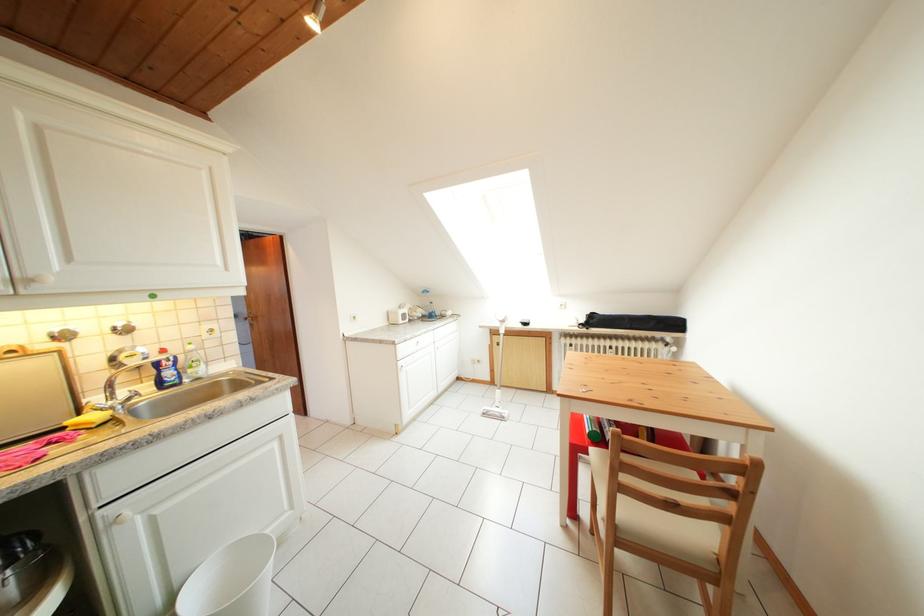
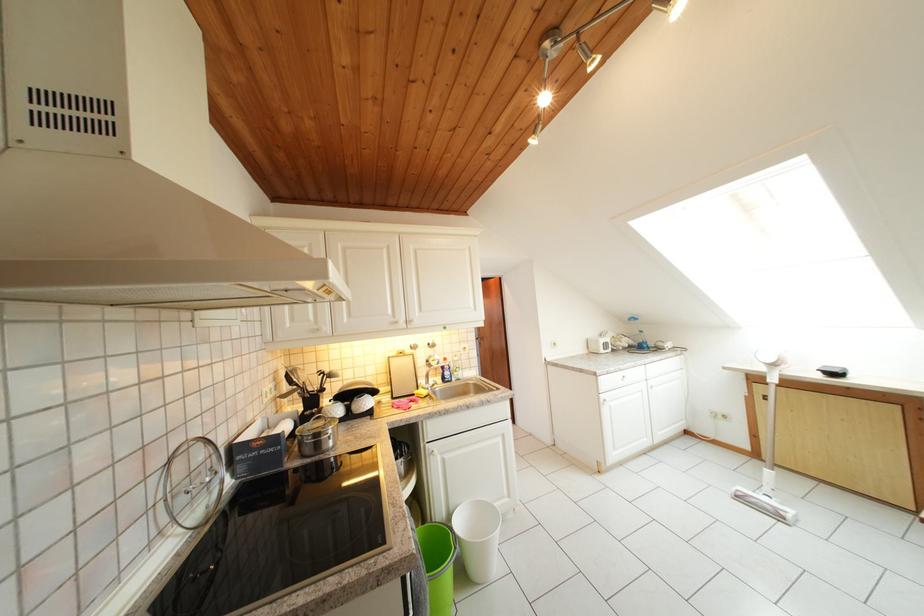
Where in the second image is the point corresponding to pixel 150 355 from the first image?

(445, 362)